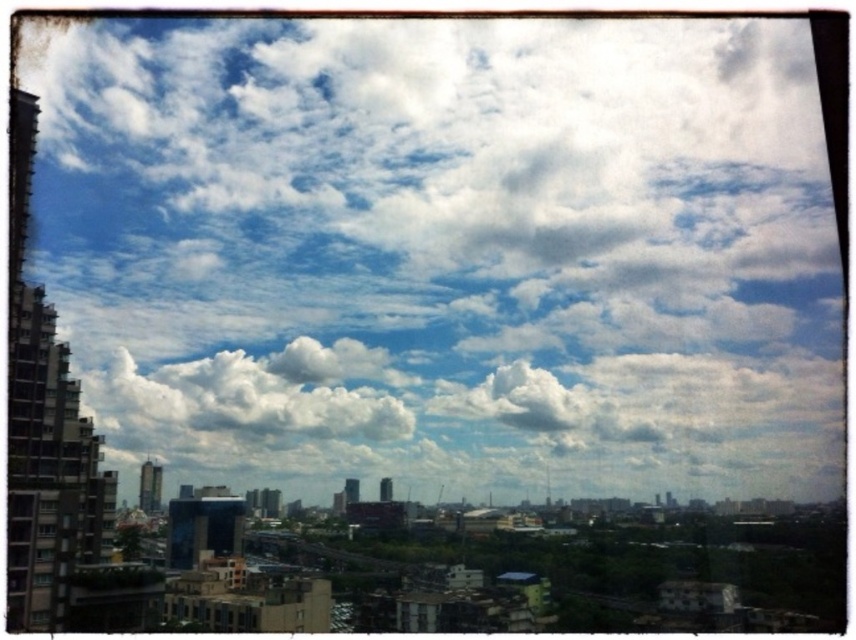
Between point (794, 209) and point (337, 385), which one is positioned in front?

Point (337, 385) is in front.

Does white fluffy cloud at upper center appear on the right side of white fluffy cloud at center?

Indeed, white fluffy cloud at upper center is positioned on the right side of white fluffy cloud at center.

The image size is (856, 640). Describe the element at coordinates (429, 259) in the screenshot. I see `white fluffy cloud at upper center` at that location.

The image size is (856, 640). What are the coordinates of `white fluffy cloud at upper center` in the screenshot? It's located at (429, 259).